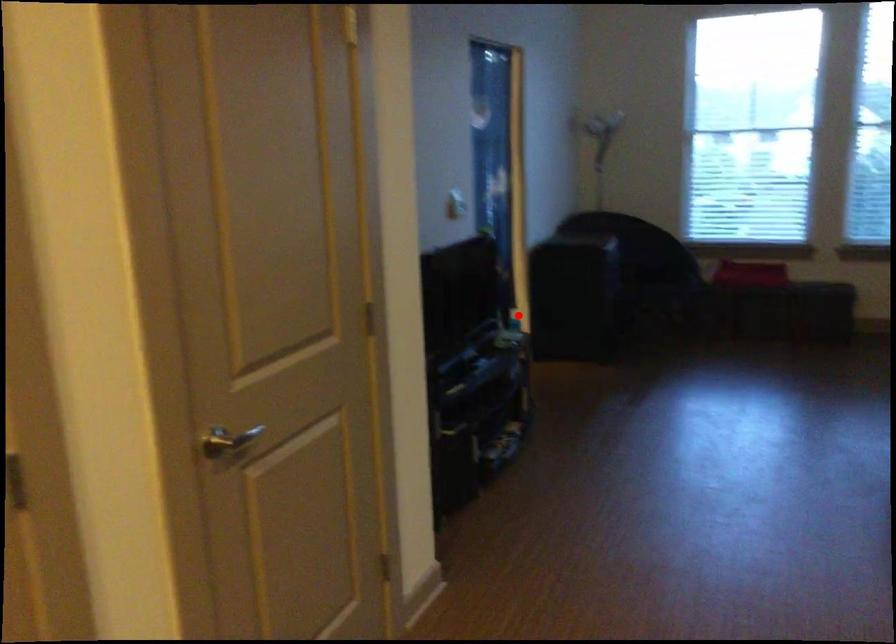
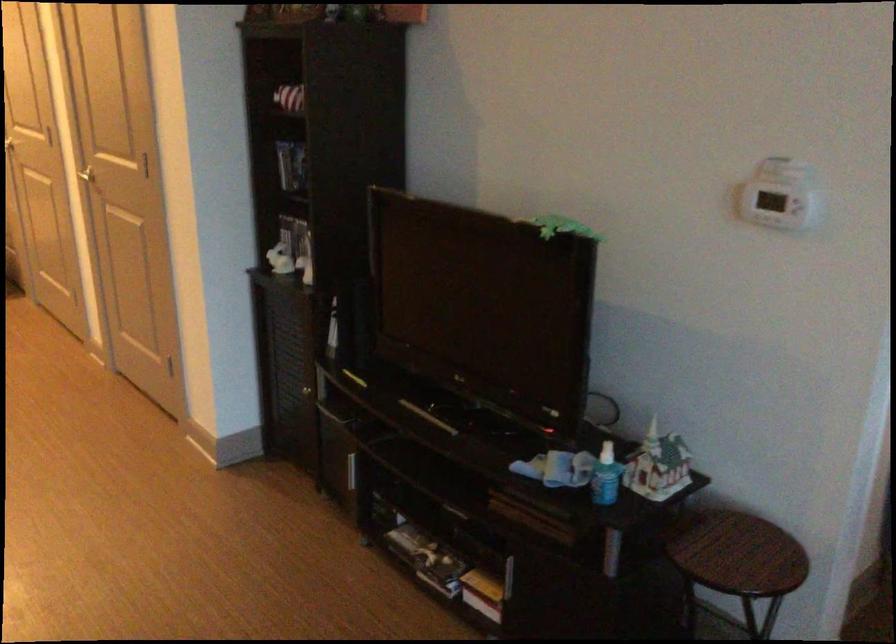
Question: I am providing you with two images of the same scene from different viewpoints. A red point is shown in image1. For the corresponding object point in image2, is it positioned nearer or farther from the camera?

Choices:
 (A) Nearer
 (B) Farther

Answer: (A)